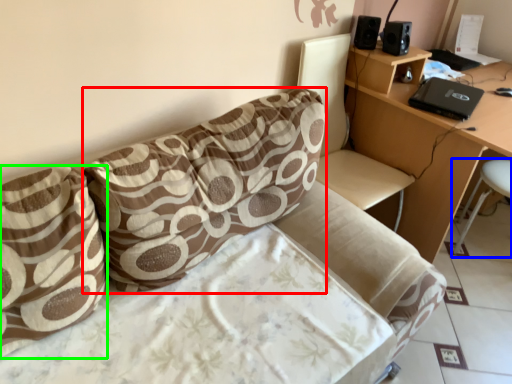
Question: Which is farther away from pillow (highlighted by a red box)? bar stool (highlighted by a blue box) or pillow (highlighted by a green box)?

Choices:
 (A) bar stool
 (B) pillow

Answer: (A)